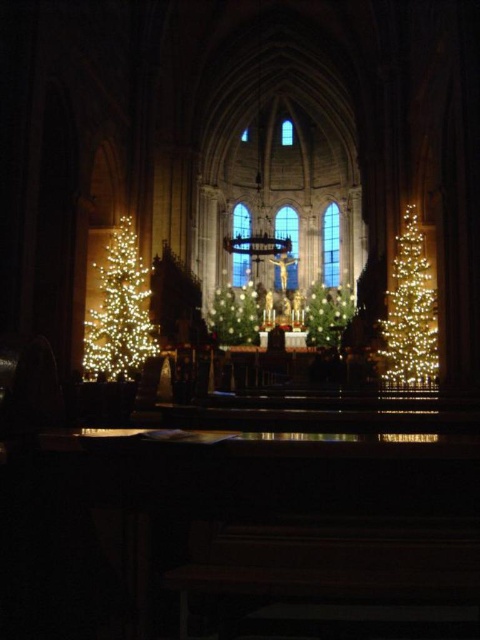
Who is higher up, illuminated wireframe at right or illuminated artificial christmas tree at center?

illuminated artificial christmas tree at center is higher up.

Describe the element at coordinates (409, 312) in the screenshot. The image size is (480, 640). I see `illuminated wireframe at right` at that location.

At what (x,y) coordinates should I click in order to perform the action: click on illuminated wireframe at right. Please return your answer as a coordinate pair (x, y). This screenshot has height=640, width=480. Looking at the image, I should click on (409, 312).

Who is more forward, (403, 328) or (236, 332)?

Positioned in front is point (403, 328).

Who is higher up, illuminated wireframe at right or green matte christmas tree at center?

Positioned higher is green matte christmas tree at center.

Does point (388, 348) come farther from viewer compared to point (257, 324)?

No.

You are a GUI agent. You are given a task and a screenshot of the screen. Output one action in this format:
    pyautogui.click(x=<x>, y=<y>)
    Task: Click on the illuminated wireframe at right
    This screenshot has height=640, width=480.
    Given the screenshot: What is the action you would take?
    pyautogui.click(x=409, y=312)

Who is positioned more to the right, illuminated plastic christmas tree at left or illuminated wireframe at right?

Positioned to the right is illuminated wireframe at right.

What do you see at coordinates (119, 308) in the screenshot? This screenshot has height=640, width=480. I see `illuminated plastic christmas tree at left` at bounding box center [119, 308].

Identify the location of illuminated plastic christmas tree at left. (119, 308).